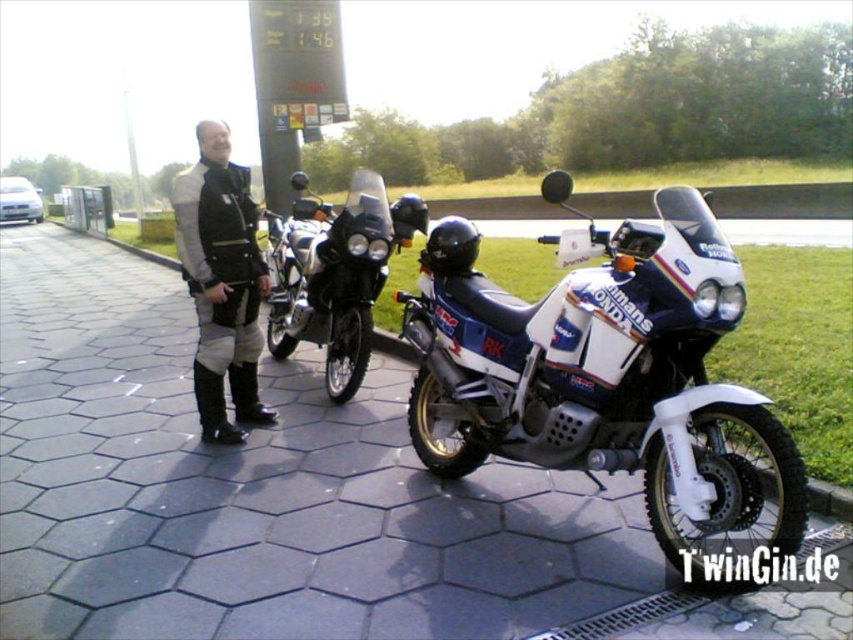
Between dark gray hexagonal tiles at center and matte black motorcycle at center, which one has less height?

Standing shorter between the two is dark gray hexagonal tiles at center.

Is dark gray hexagonal tiles at center closer to camera compared to matte black motorcycle at center?

Yes.

Between point (508, 596) and point (352, 387), which one is positioned behind?

Point (352, 387)

Locate an element on the screen. dark gray hexagonal tiles at center is located at coordinates (258, 488).

Image resolution: width=853 pixels, height=640 pixels. Describe the element at coordinates (605, 376) in the screenshot. I see `white matte motorcycle at center` at that location.

At what (x,y) coordinates should I click in order to perform the action: click on white matte motorcycle at center. Please return your answer as a coordinate pair (x, y). The height and width of the screenshot is (640, 853). Looking at the image, I should click on (605, 376).

Does dark gray hexagonal tiles at center have a smaller size compared to white matte motorcycle at center?

Correct, dark gray hexagonal tiles at center occupies less space than white matte motorcycle at center.

Consider the image. Does dark gray hexagonal tiles at center have a larger size compared to white matte motorcycle at center?

No, dark gray hexagonal tiles at center is not bigger than white matte motorcycle at center.

This screenshot has height=640, width=853. What do you see at coordinates (258, 488) in the screenshot?
I see `dark gray hexagonal tiles at center` at bounding box center [258, 488].

Identify the location of dark gray hexagonal tiles at center. (258, 488).